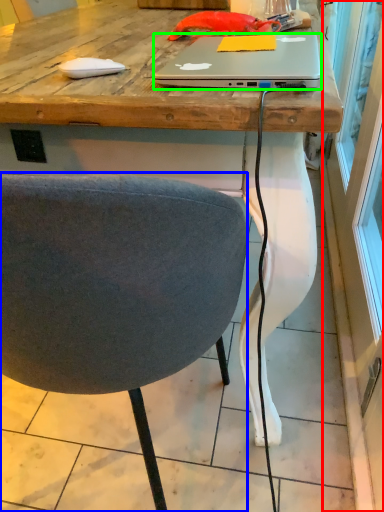
Question: Estimate the real-world distances between objects in this image. Which object is farther from screen door (highlighted by a red box), chair (highlighted by a blue box) or laptop (highlighted by a green box)?

Choices:
 (A) chair
 (B) laptop

Answer: (B)